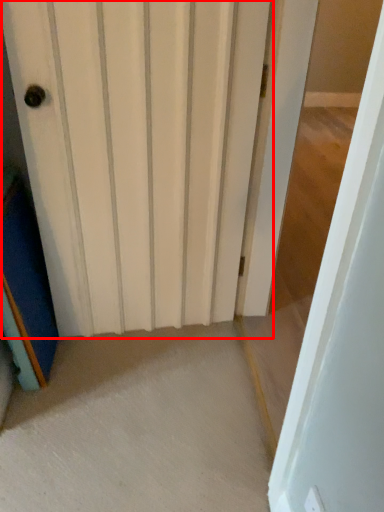
Question: Where is door (annotated by the red box) located in relation to door in the image?

Choices:
 (A) right
 (B) left

Answer: (B)